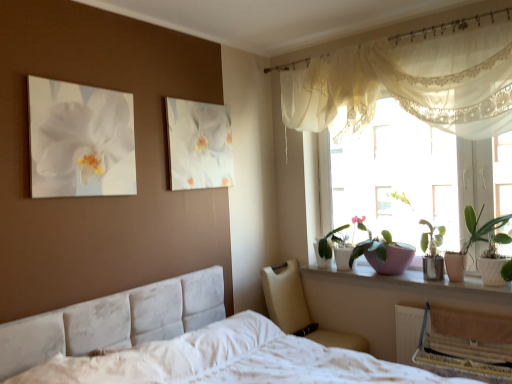
Question: Are sheer white curtain at upper right and white glossy bowl at upper right located far from each other?

Choices:
 (A) no
 (B) yes

Answer: (B)

Question: Is sheer white curtain at upper right to the left of white glossy bowl at upper right from the viewer's perspective?

Choices:
 (A) no
 (B) yes

Answer: (B)

Question: Does sheer white curtain at upper right contain white glossy bowl at upper right?

Choices:
 (A) no
 (B) yes

Answer: (A)

Question: Is sheer white curtain at upper right taller than white glossy bowl at upper right?

Choices:
 (A) yes
 (B) no

Answer: (A)

Question: From a real-world perspective, does sheer white curtain at upper right stand above white glossy bowl at upper right?

Choices:
 (A) yes
 (B) no

Answer: (A)

Question: Does point click(x=295, y=79) appear closer or farther from the camera than point click(x=317, y=244)?

Choices:
 (A) farther
 (B) closer

Answer: (B)

Question: Considering the positions of sheer white curtain at upper right and green glossy leafy plant at window, positioned as the 2th houseplant in right-to-left order, in the image, is sheer white curtain at upper right taller or shorter than green glossy leafy plant at window, positioned as the 2th houseplant in right-to-left order,?

Choices:
 (A) tall
 (B) short

Answer: (A)

Question: Do you think sheer white curtain at upper right is within green glossy leafy plant at window, acting as the first houseplant starting from the left, or outside of it?

Choices:
 (A) outside
 (B) inside

Answer: (A)

Question: Is sheer white curtain at upper right wider or thinner than green glossy leafy plant at window, positioned as the 2th houseplant in right-to-left order?

Choices:
 (A) wide
 (B) thin

Answer: (A)

Question: Is point (128, 140) closer or farther from the camera than point (353, 256)?

Choices:
 (A) farther
 (B) closer

Answer: (B)

Question: From a real-world perspective, is white glossy orchid at upper left above or below pink matte pot at window?

Choices:
 (A) above
 (B) below

Answer: (A)

Question: From their relative heights in the image, would you say white glossy orchid at upper left is taller or shorter than pink matte pot at window?

Choices:
 (A) tall
 (B) short

Answer: (A)

Question: Visually, is white glossy orchid at upper left positioned to the left or to the right of pink matte pot at window?

Choices:
 (A) right
 (B) left

Answer: (B)

Question: Choose the correct answer: Is translucent fabric at upper right inside white glossy canvas at upper center or outside it?

Choices:
 (A) outside
 (B) inside

Answer: (A)

Question: From the image's perspective, is translucent fabric at upper right located above or below white glossy canvas at upper center?

Choices:
 (A) above
 (B) below

Answer: (B)